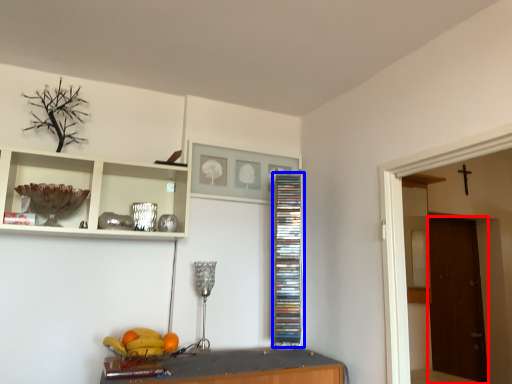
Question: Which object is closer to the camera taking this photo, door (highlighted by a red box) or cabinet (highlighted by a blue box)?

Choices:
 (A) door
 (B) cabinet

Answer: (B)